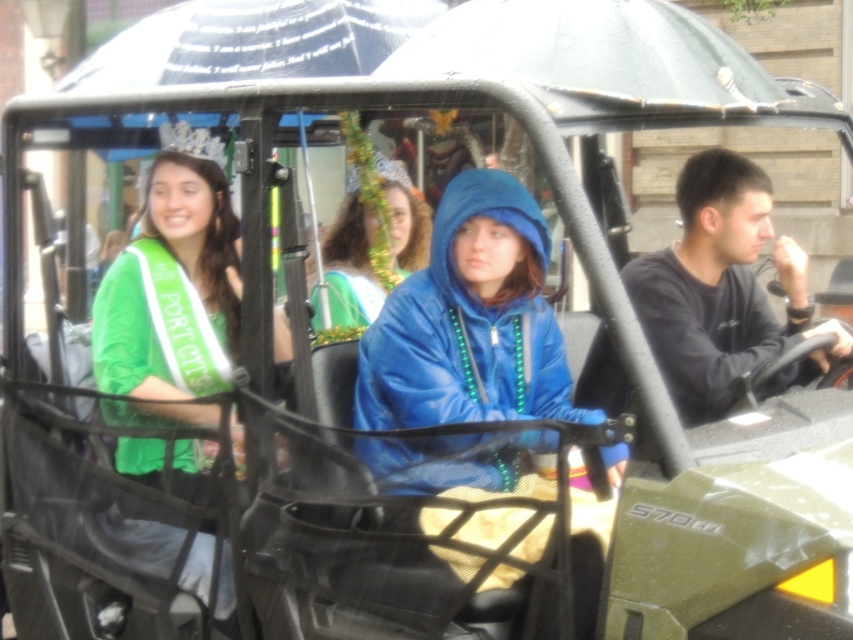
Question: Is dark gray sweatshirt at right smaller than blue matte jacket at center?

Choices:
 (A) no
 (B) yes

Answer: (A)

Question: Is green satin sash at left positioned before blue matte jacket at center?

Choices:
 (A) yes
 (B) no

Answer: (A)

Question: Among these points, which one is farthest from the camera?

Choices:
 (A) (151, 262)
 (B) (714, 358)

Answer: (A)

Question: In this image, where is green satin sash at left located relative to blue matte jacket at center?

Choices:
 (A) below
 (B) above

Answer: (A)

Question: Among these points, which one is nearest to the camera?

Choices:
 (A) [x=169, y=195]
 (B) [x=326, y=236]
 (C) [x=846, y=344]

Answer: (C)

Question: Based on their relative distances, which object is farther from the blue matte jacket at center?

Choices:
 (A) green satin sash at left
 (B) dark gray sweatshirt at right

Answer: (B)